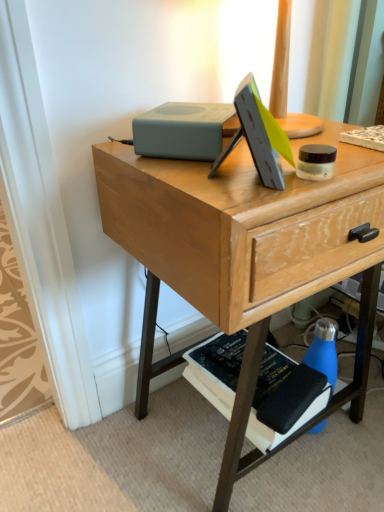
Image resolution: width=384 pixels, height=512 pixels. I want to click on empty space that is ontop of wooden desk at center (from a real-world perspective), so click(x=297, y=144).